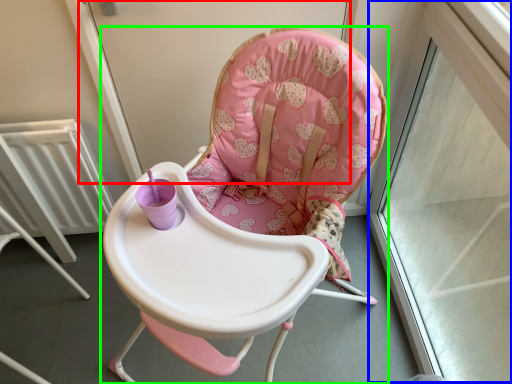
Question: Considering the real-world distances, which object is closest to screen door (highlighted by a red box)? window frame (highlighted by a blue box) or chair (highlighted by a green box).

Choices:
 (A) window frame
 (B) chair

Answer: (B)